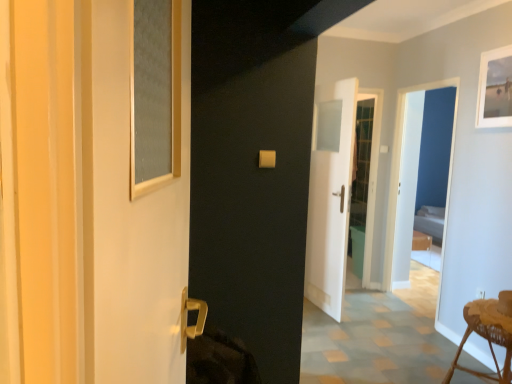
Question: From the image's perspective, relative to white fabric bed at right, is white matte picture frame at upper right above or below?

Choices:
 (A) above
 (B) below

Answer: (A)

Question: Is white matte picture frame at upper right taller or shorter than white fabric bed at right?

Choices:
 (A) tall
 (B) short

Answer: (B)

Question: Which object is positioned closest to the woven wood stool at lower right?

Choices:
 (A) matte glass screen door at left, which ranks as the 2th screen door in right-to-left order
 (B) white matte picture frame at upper right
 (C) white fabric bed at right
 (D) white glossy screen door at center, which is the first screen door in back-to-front order

Answer: (D)

Question: Which is nearer to the white fabric bed at right?

Choices:
 (A) woven wood stool at lower right
 (B) matte glass screen door at left, which is counted as the 2th screen door, starting from the back
 (C) white glossy screen door at center, which is counted as the second screen door, starting from the left
 (D) white matte picture frame at upper right

Answer: (C)